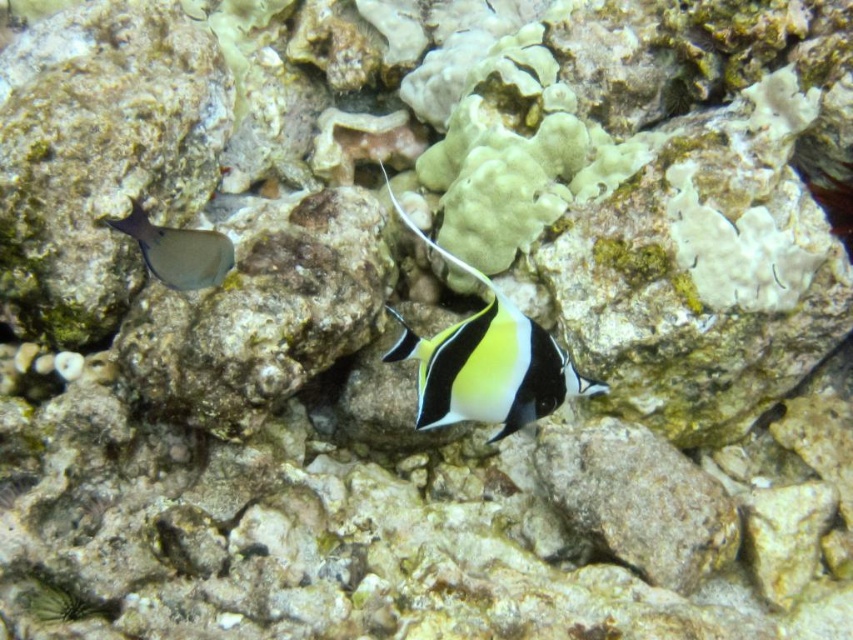
Between black glossy fish at center and smooth gray fish at left, which one appears on the right side from the viewer's perspective?

black glossy fish at center

Does black glossy fish at center have a lesser height compared to smooth gray fish at left?

No.

Measure the distance between black glossy fish at center and camera.

black glossy fish at center and camera are 94.08 centimeters apart from each other.

This screenshot has height=640, width=853. I want to click on black glossy fish at center, so [486, 362].